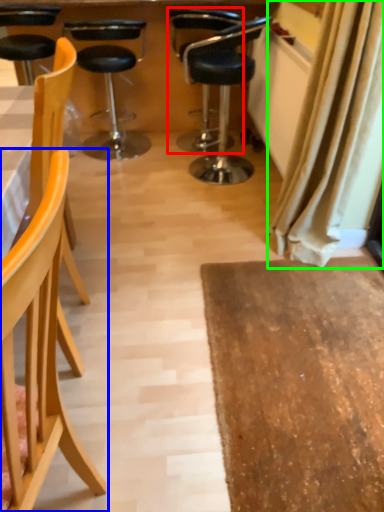
Question: Estimate the real-world distances between objects in this image. Which object is closer to chair (highlighted by a red box), chair (highlighted by a blue box) or curtain (highlighted by a green box)?

Choices:
 (A) chair
 (B) curtain

Answer: (B)